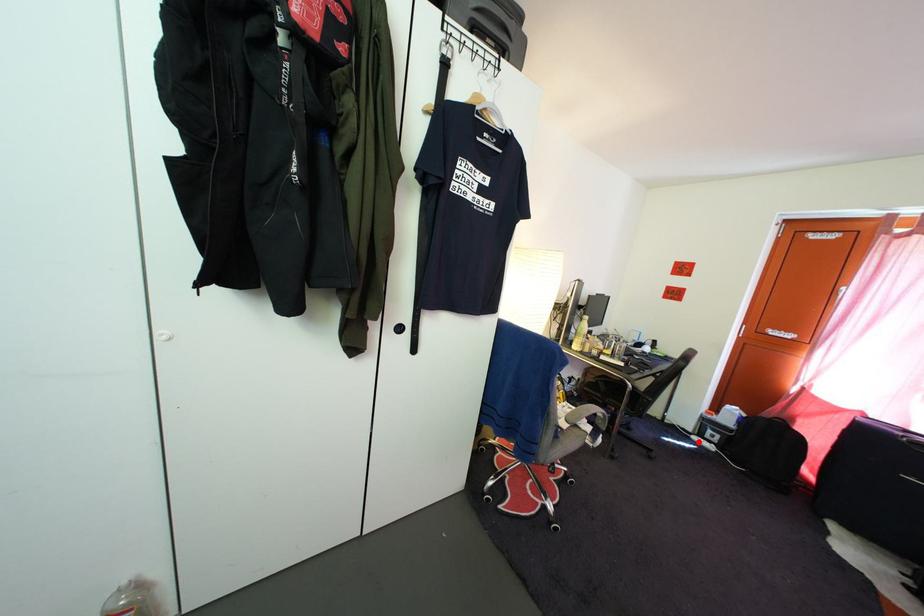
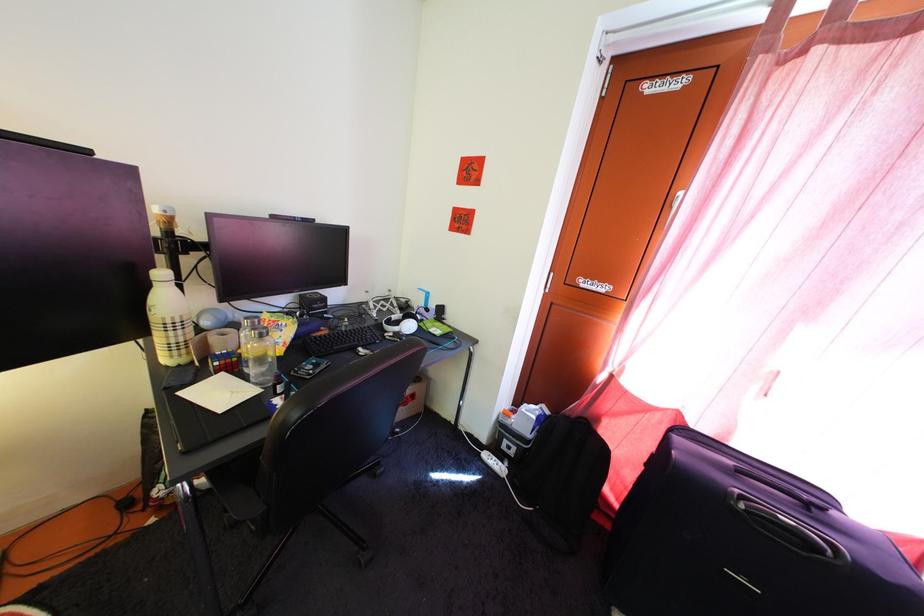
In the second image, find the point that corresponds to the highlighted location in the first image.

(492, 456)